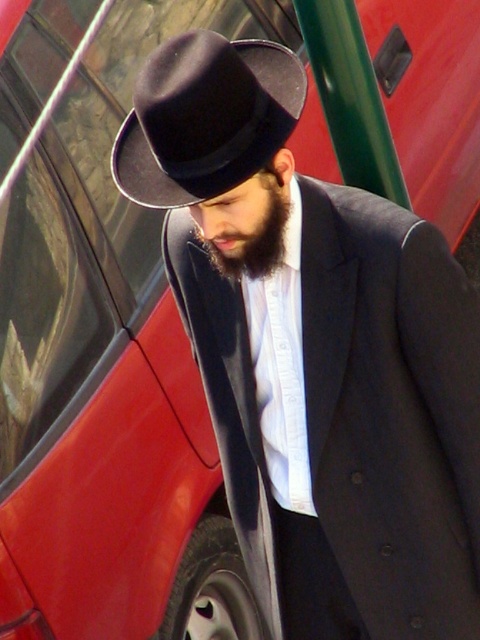
Which is in front, point (342, 365) or point (261, 42)?

Point (342, 365) is in front.

Which is behind, point (324, 344) or point (215, 138)?

The point (324, 344) is behind.

Is point (339, 392) farther from camera compared to point (165, 156)?

Yes.

Locate an element on the screen. This screenshot has width=480, height=640. matte black hat at center is located at coordinates (320, 358).

Is matte black hat at center positioned at the back of dark brown fuzzy beard at center?

No, it is not.

Who is shorter, matte black hat at center or dark brown fuzzy beard at center?

With less height is dark brown fuzzy beard at center.

Where is `matte black hat at center`? matte black hat at center is located at coordinates (320, 358).

Looking at this image, which of these two, black felt fedora at center or dark brown fuzzy beard at center, stands taller?

black felt fedora at center

Between point (265, 161) and point (214, 227), which one is positioned behind?

The point (214, 227) is more distant.

Image resolution: width=480 pixels, height=640 pixels. Find the location of `black felt fedora at center`. black felt fedora at center is located at coordinates (205, 116).